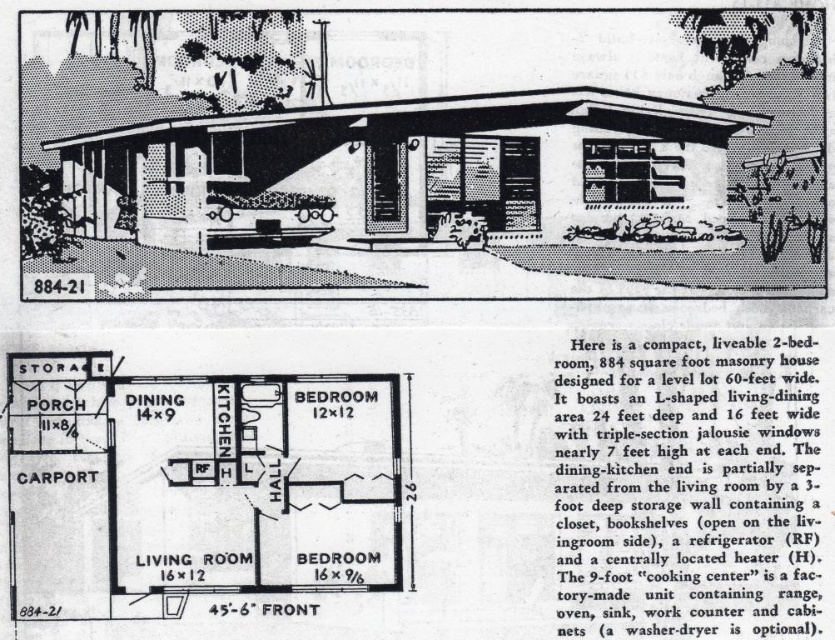
Does white textured carport at lower left have a greater width compared to white glossy kitchen at center?

Yes, white textured carport at lower left is wider than white glossy kitchen at center.

Consider the image. Is white textured carport at lower left to the left of white glossy kitchen at center from the viewer's perspective?

In fact, white textured carport at lower left is to the right of white glossy kitchen at center.

Does point (155, 138) come in front of point (355, 556)?

That is False.

Locate an element on the screen. The image size is (835, 640). white textured carport at lower left is located at coordinates (418, 173).